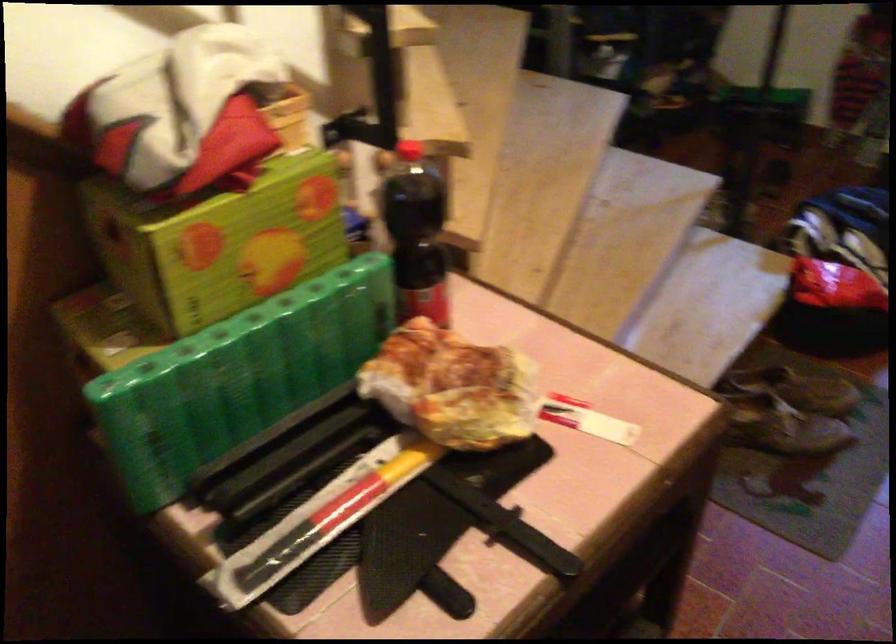
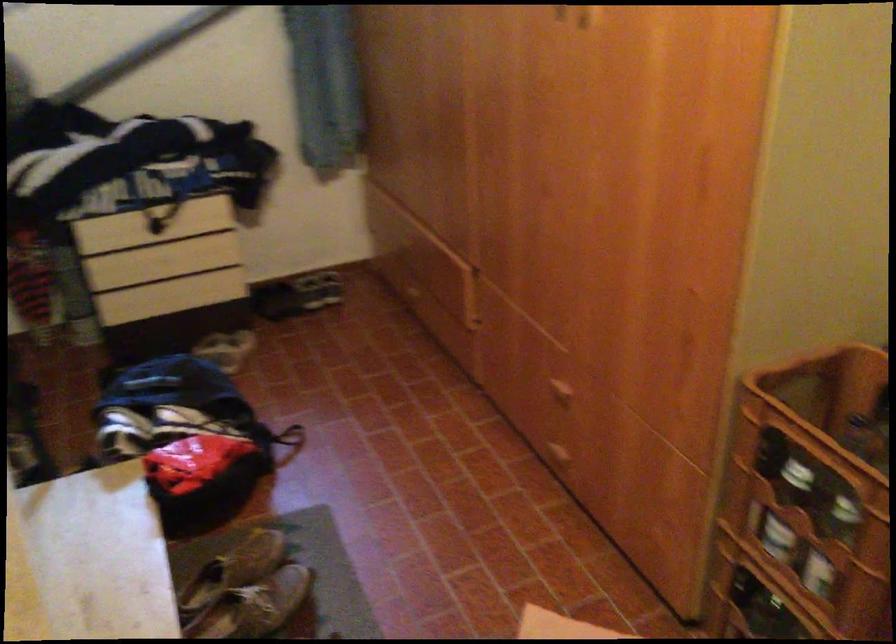
Locate, in the second image, the point that corresponds to pixel 780 415 in the first image.

(244, 590)